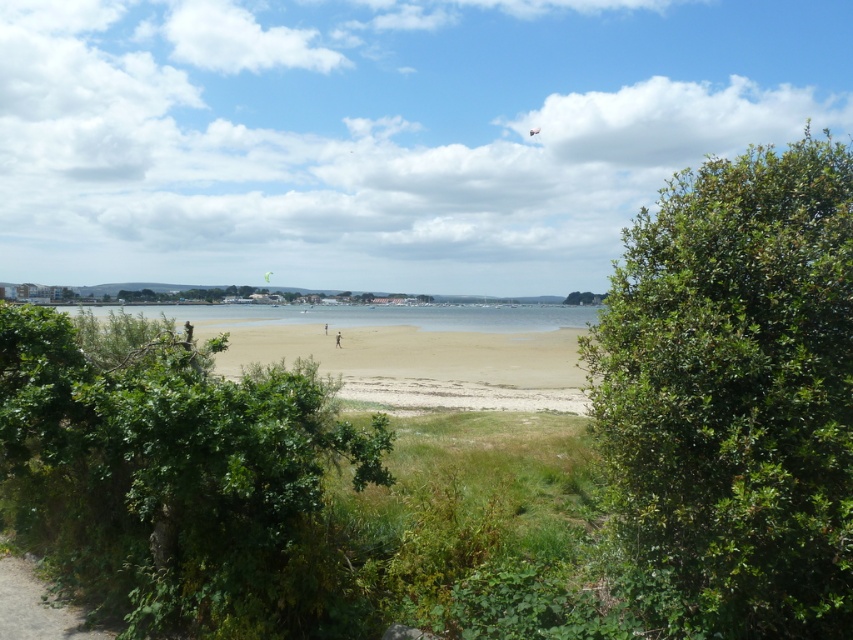
Measure the distance between point [785,291] and camera.

Point [785,291] and camera are 9.44 feet apart from each other.

Which is more to the left, green leafy bush at right or green leafy bush at lower left?

From the viewer's perspective, green leafy bush at lower left appears more on the left side.

Which is behind, point (807, 620) or point (172, 410)?

Positioned behind is point (172, 410).

This screenshot has width=853, height=640. In order to click on green leafy bush at right in this screenshot , I will do `click(733, 397)`.

Does green leafy bush at right come in front of brown sand at center?

Yes, it is in front of brown sand at center.

Can you confirm if green leafy bush at right is smaller than brown sand at center?

No.

The width and height of the screenshot is (853, 640). What are the coordinates of `green leafy bush at right` in the screenshot? It's located at (733, 397).

Image resolution: width=853 pixels, height=640 pixels. What are the coordinates of `green leafy bush at right` in the screenshot? It's located at (733, 397).

Does point (701, 628) come closer to viewer compared to point (537, 340)?

Yes, point (701, 628) is closer to viewer.

Where is `green leafy bush at right`? green leafy bush at right is located at coordinates (733, 397).